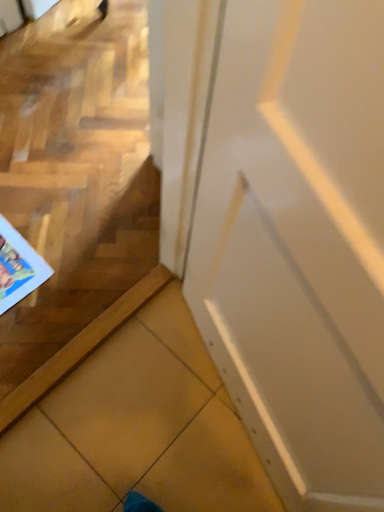
Where is `vacant space underneath white glossy door at center (from a real-world perspective)`? vacant space underneath white glossy door at center (from a real-world perspective) is located at coordinates (225, 406).